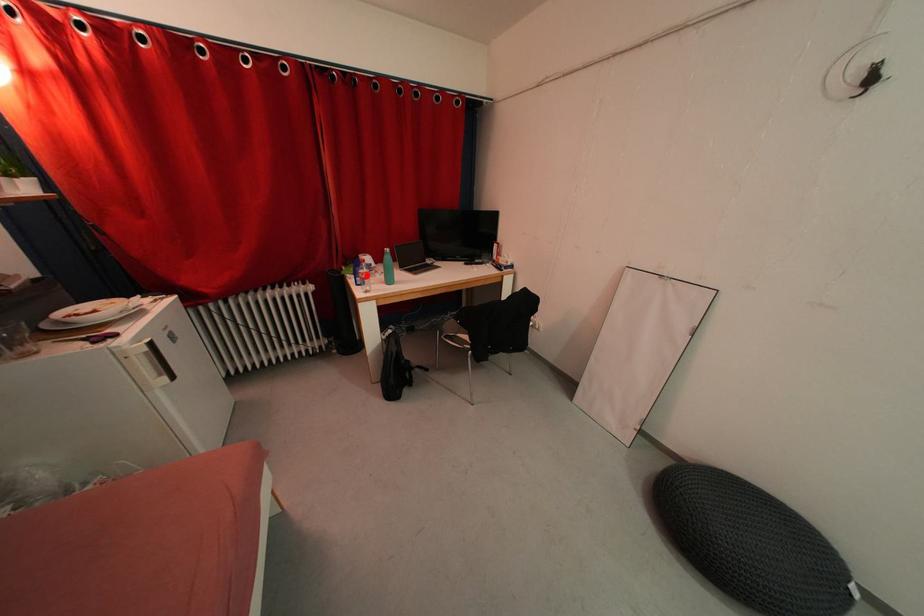
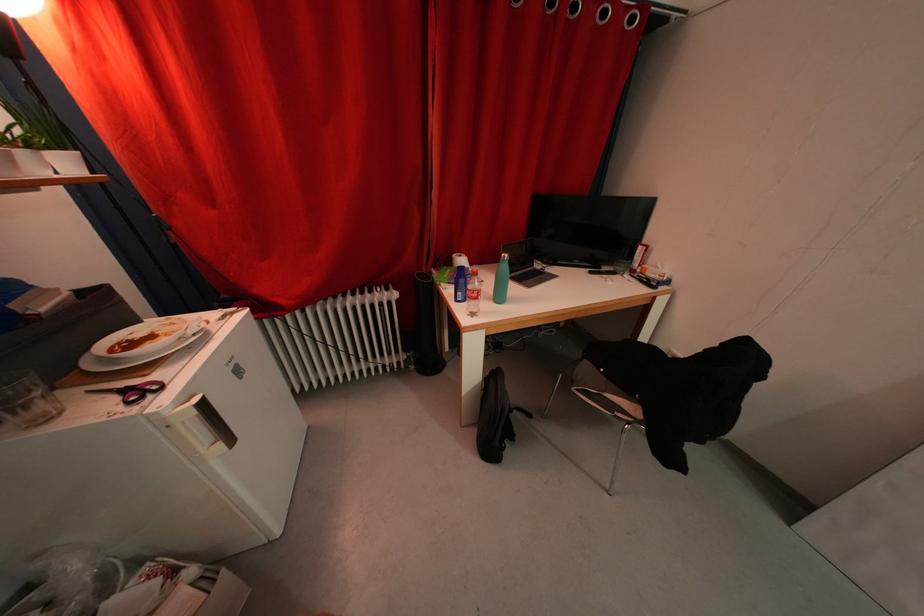
The point at the highlighted location is marked in the first image. Where is the corresponding point in the second image?

(476, 291)